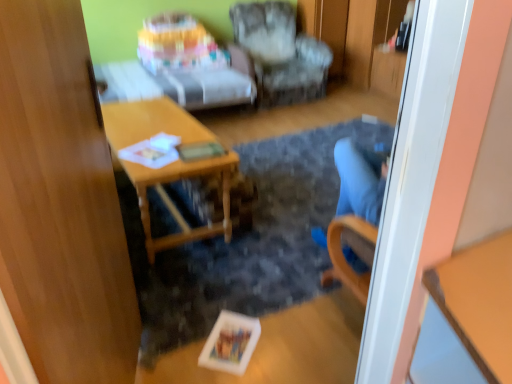
Question: Does point (292, 64) appear closer or farther from the camera than point (35, 148)?

Choices:
 (A) farther
 (B) closer

Answer: (A)

Question: From a real-world perspective, is textured fabric armchair at center positioned above or below transparent wood door at left?

Choices:
 (A) above
 (B) below

Answer: (B)

Question: Which is farther from the pastel fabric couch at upper center?

Choices:
 (A) transparent wood door at left
 (B) wooden desk at center
 (C) textured fabric armchair at center

Answer: (A)

Question: Which of these objects is positioned closest to the textured fabric armchair at center?

Choices:
 (A) transparent wood door at left
 (B) pastel fabric couch at upper center
 (C) wooden desk at center

Answer: (B)